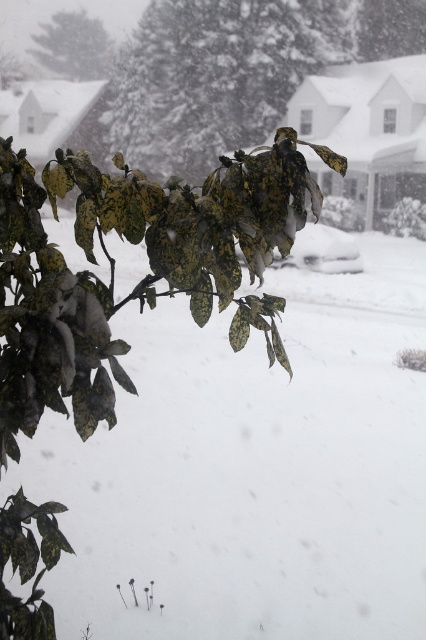
Question: Which point appears farthest from the camera in this image?

Choices:
 (A) (164, 93)
 (B) (80, 44)

Answer: (B)

Question: Can you confirm if green matte leaves at center is positioned to the right of green leafy branch at upper left?

Choices:
 (A) yes
 (B) no

Answer: (A)

Question: Can you confirm if green matte leaves at center is positioned to the left of green leafy branch at upper left?

Choices:
 (A) yes
 (B) no

Answer: (B)

Question: Does green matte leaves at center appear on the left side of green leafy branch at upper left?

Choices:
 (A) no
 (B) yes

Answer: (A)